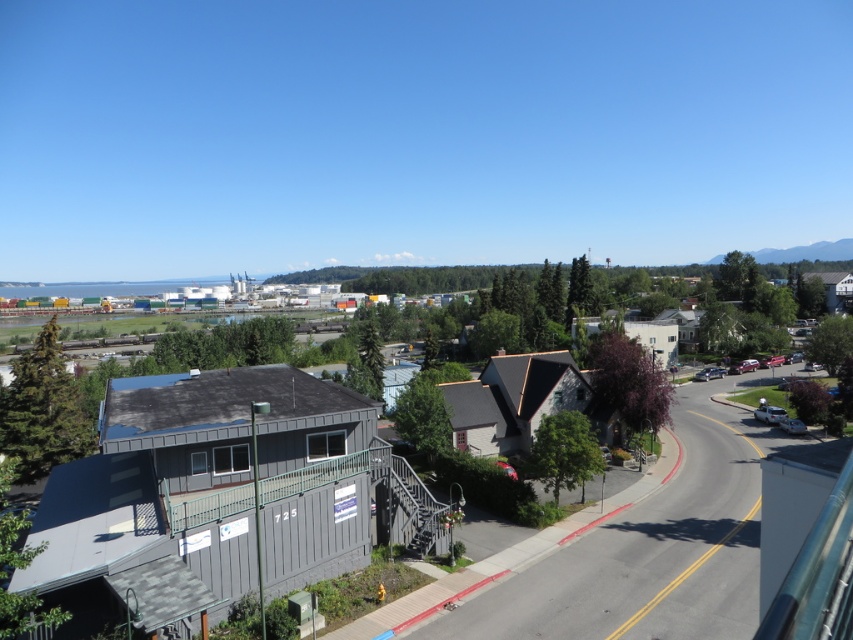
Based on the photo, you are a delivery driver approaching the street in the image. You need to park your vehicle, which is the same size as the silver metallic sedan at lower right. There is space behind the white glossy car at lower right. Can your vehicle fit in that space?

The silver metallic sedan at lower right is behind the white glossy car at lower right. Since your vehicle is the same size as the silver metallic sedan at lower right, it should fit in the space behind the white glossy car at lower right as long as the distance matches.

You are a delivery driver approaching the gray wood town at center and the white glossy car at lower right. Based on their positions, which object is closer to the road?

The gray wood town at center is located below the white glossy car at lower right, meaning it is closer to the road.